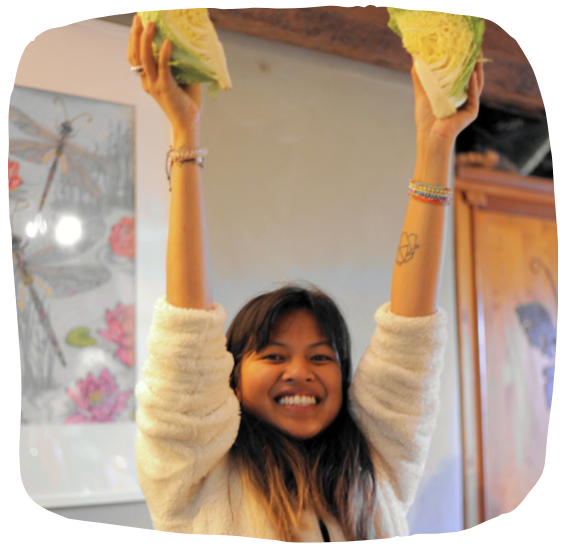
The image size is (564, 546). I want to click on framed poster, so click(90, 318), click(519, 334).